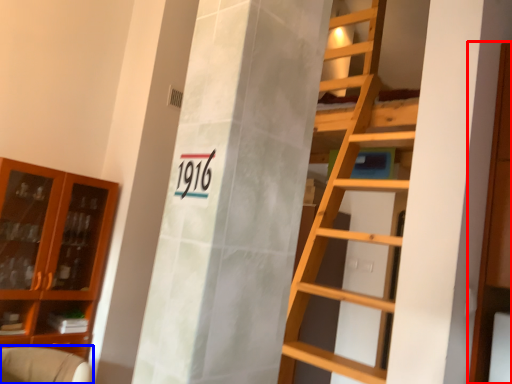
Question: Among these objects, which one is nearest to the camera, cabinetry (highlighted by a red box) or armchair (highlighted by a blue box)?

Choices:
 (A) cabinetry
 (B) armchair

Answer: (A)